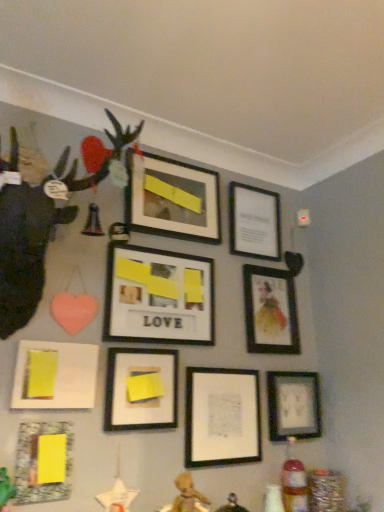
Question: From the image's perspective, is matte black picture frame at lower right, the ninth picture frame when ordered from left to right, beneath matte black picture frame at center, which is the 4th picture frame in right-to-left order?

Choices:
 (A) no
 (B) yes

Answer: (B)

Question: Would you say matte black picture frame at lower right, the ninth picture frame when ordered from left to right, is a long distance from matte black picture frame at center, which is the 4th picture frame in right-to-left order?

Choices:
 (A) no
 (B) yes

Answer: (A)

Question: Does matte black picture frame at lower right, the ninth picture frame when ordered from left to right, have a greater height compared to matte black picture frame at center, arranged as the 6th picture frame when viewed from the left?

Choices:
 (A) no
 (B) yes

Answer: (A)

Question: Does matte black picture frame at lower right, which is the first picture frame in right-to-left order, appear on the left side of matte black picture frame at center, which is the 4th picture frame in right-to-left order?

Choices:
 (A) no
 (B) yes

Answer: (A)

Question: From a real-world perspective, is matte black picture frame at lower right, the ninth picture frame when ordered from left to right, located beneath matte black picture frame at center, which is the 4th picture frame in right-to-left order?

Choices:
 (A) no
 (B) yes

Answer: (A)

Question: Is the depth of matte black picture frame at lower right, which is the first picture frame in right-to-left order, greater than that of matte black picture frame at center, arranged as the 6th picture frame when viewed from the left?

Choices:
 (A) yes
 (B) no

Answer: (A)

Question: Considering the relative sizes of matte black figurine at left and matte black picture frame at center, which is counted as the 7th picture frame, starting from the right, in the image provided, is matte black figurine at left thinner than matte black picture frame at center, which is counted as the 7th picture frame, starting from the right,?

Choices:
 (A) yes
 (B) no

Answer: (B)

Question: Are matte black figurine at left and matte black picture frame at center, which is counted as the 7th picture frame, starting from the right, far apart?

Choices:
 (A) yes
 (B) no

Answer: (B)

Question: Can you confirm if matte black figurine at left is smaller than matte black picture frame at center, which is the third picture frame in left-to-right order?

Choices:
 (A) no
 (B) yes

Answer: (A)

Question: Does matte black figurine at left have a greater width compared to matte black picture frame at center, which is the third picture frame in left-to-right order?

Choices:
 (A) no
 (B) yes

Answer: (B)

Question: Is matte black figurine at left at the right side of matte black picture frame at center, which is counted as the 7th picture frame, starting from the right?

Choices:
 (A) yes
 (B) no

Answer: (B)

Question: From the image's perspective, is matte black figurine at left on matte black picture frame at center, which is counted as the 7th picture frame, starting from the right?

Choices:
 (A) no
 (B) yes

Answer: (B)

Question: Is matte glass picture frame at lower left, which ranks as the 9th picture frame in right-to-left order, far away from matte black figurine at left?

Choices:
 (A) no
 (B) yes

Answer: (A)